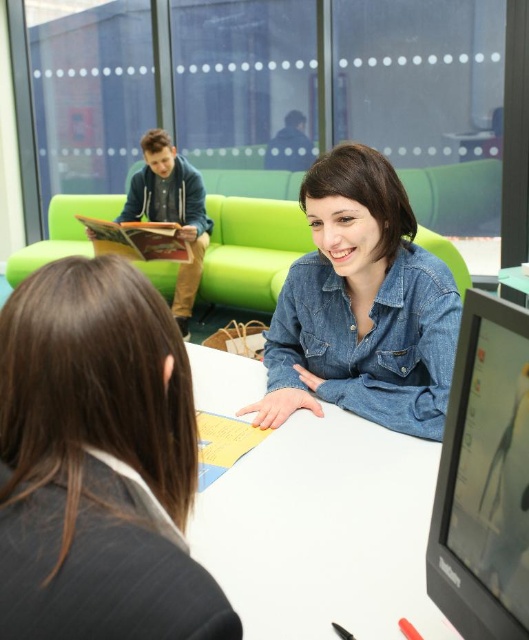
Question: Which point is farther from the camera taking this photo?

Choices:
 (A) (223, 548)
 (B) (259, 422)
 (C) (204, 246)

Answer: (C)

Question: Is denim shirt at center positioned behind dark blue hoodie at upper left?

Choices:
 (A) no
 (B) yes

Answer: (A)

Question: Which object is closer to the camera taking this photo?

Choices:
 (A) denim shirt at center
 (B) denim jacket at center
 (C) dark blue hoodie at upper left

Answer: (B)

Question: Does denim jacket at center have a greater width compared to denim shirt at center?

Choices:
 (A) yes
 (B) no

Answer: (B)

Question: Based on their relative distances, which object is farther from the white glossy table at center?

Choices:
 (A) denim shirt at center
 (B) black glossy monitor at lower right
 (C) dark blue hoodie at upper left

Answer: (C)

Question: Is denim jacket at center positioned in front of dark blue hoodie at upper left?

Choices:
 (A) no
 (B) yes

Answer: (B)